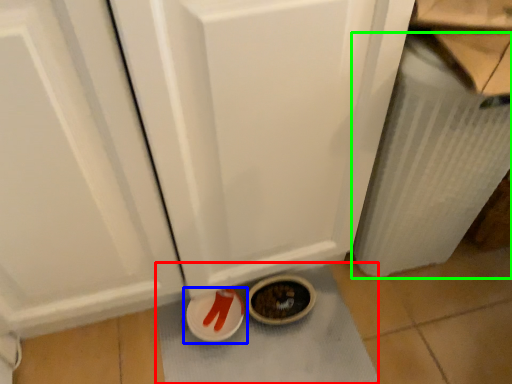
Question: Based on their relative distances, which object is farther from bath mat (highlighted by a red box)? Choose from footwear (highlighted by a blue box) and radiator (highlighted by a green box).

Choices:
 (A) footwear
 (B) radiator

Answer: (B)